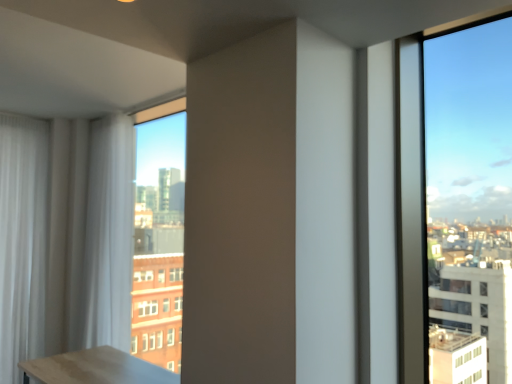
Where is `vacant area on top of white sheer curtain at left, marked as the 1th curtain in a left-to-right arrangement (from a real-world perspective)`? This screenshot has width=512, height=384. vacant area on top of white sheer curtain at left, marked as the 1th curtain in a left-to-right arrangement (from a real-world perspective) is located at coordinates (22, 111).